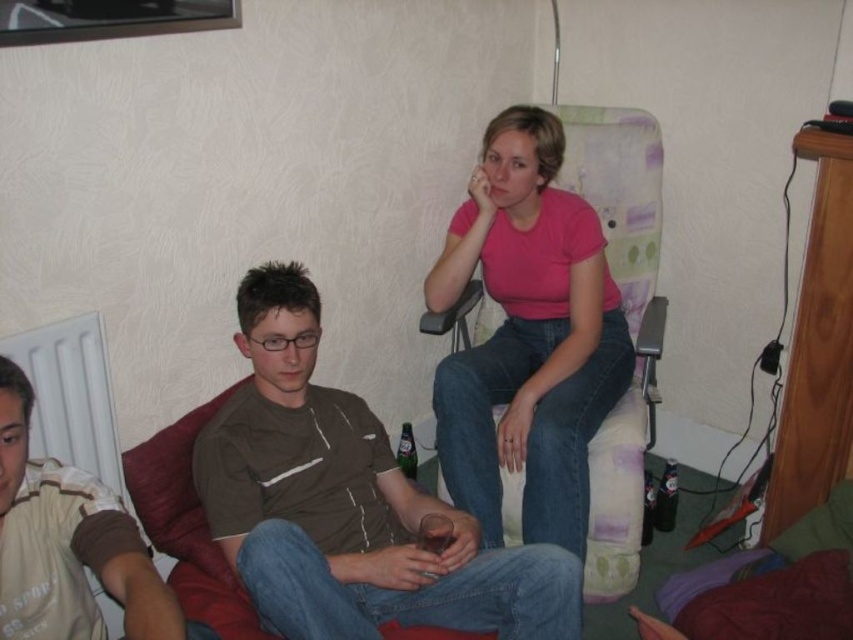
Question: Does pink matte shirt at center have a larger size compared to green glass bottle at lower right?

Choices:
 (A) no
 (B) yes

Answer: (B)

Question: Which object appears closest to the camera in this image?

Choices:
 (A) translucent plastic bottle at lower right
 (B) green glass bottle at lower right

Answer: (B)

Question: Can you confirm if translucent plastic bottle at lower right is wider than green glass bottle at center?

Choices:
 (A) yes
 (B) no

Answer: (A)

Question: Which of the following is the farthest from the observer?

Choices:
 (A) (578, 314)
 (B) (672, 492)
 (C) (1, 545)
 (D) (650, 483)

Answer: (B)

Question: Can you confirm if pink matte shirt at center is positioned above green glass bottle at center?

Choices:
 (A) yes
 (B) no

Answer: (A)

Question: Which point is farther to the camera?

Choices:
 (A) (289, 384)
 (B) (663, 472)

Answer: (B)